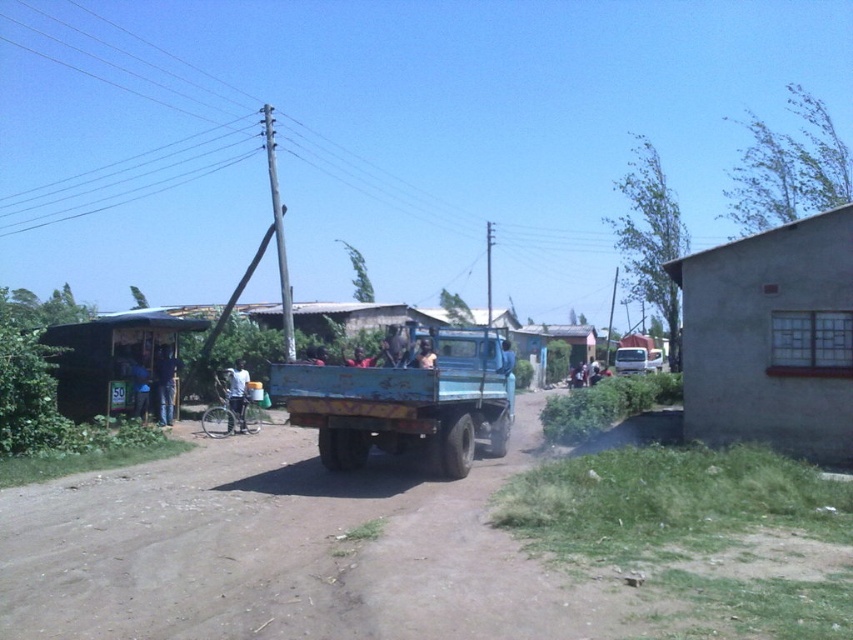
Question: Which object is closer to the camera taking this photo?

Choices:
 (A) brown dirt track at center
 (B) gray concrete hut at right

Answer: (A)

Question: Which point is closer to the camera?

Choices:
 (A) light brown leather jacket at center
 (B) white matte bicycle at center

Answer: (A)

Question: Which point is closer to the camera?

Choices:
 (A) gray concrete hut at right
 (B) blue matte truck at center
 (C) white matte bicycle at center

Answer: (B)

Question: Can you confirm if wooden hut at left is positioned above light brown leather jacket at center?

Choices:
 (A) no
 (B) yes

Answer: (B)

Question: Is gray concrete hut at right positioned before white matte bicycle at center?

Choices:
 (A) no
 (B) yes

Answer: (B)

Question: Does wooden hut at left appear on the right side of blue corrugated metal hut at center?

Choices:
 (A) no
 (B) yes

Answer: (A)